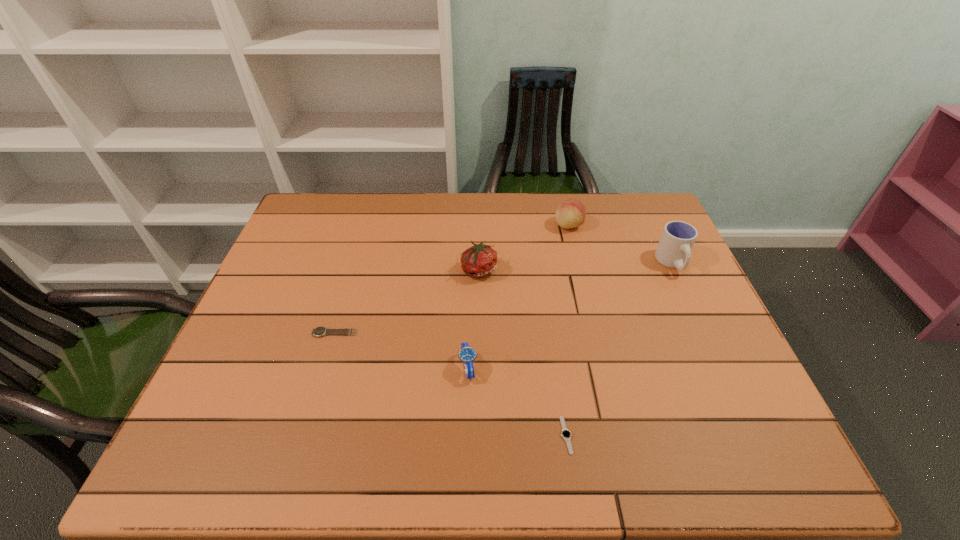
Find the location of a particular element. cup is located at coordinates [674, 249].

Where is `the rightmost object`? The image size is (960, 540). the rightmost object is located at coordinates (674, 249).

The image size is (960, 540). I want to click on the second object from right to left, so click(571, 213).

Where is `peach`? This screenshot has width=960, height=540. peach is located at coordinates (571, 213).

Where is `tomato`? tomato is located at coordinates (480, 260).

This screenshot has height=540, width=960. Find the location of `the second watch from right to left`. the second watch from right to left is located at coordinates (467, 354).

The width and height of the screenshot is (960, 540). What are the coordinates of `the fourth tallest object` in the screenshot? It's located at (467, 354).

Locate an element on the screen. The width and height of the screenshot is (960, 540). the farthest watch is located at coordinates (320, 331).

I want to click on the fifth tallest object, so click(x=320, y=331).

The height and width of the screenshot is (540, 960). Find the location of `the nearest object`. the nearest object is located at coordinates (566, 434).